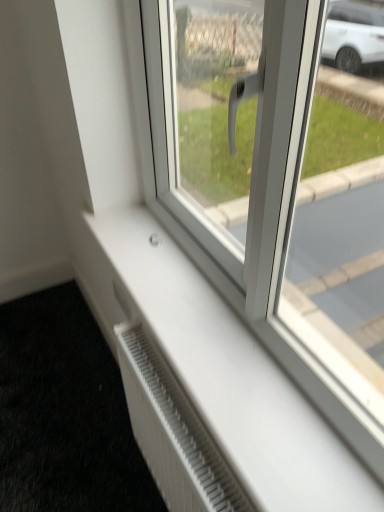
Where is `free space above white textured radiator at lower left (from a real-world perspective)`? Image resolution: width=384 pixels, height=512 pixels. free space above white textured radiator at lower left (from a real-world perspective) is located at coordinates (58, 386).